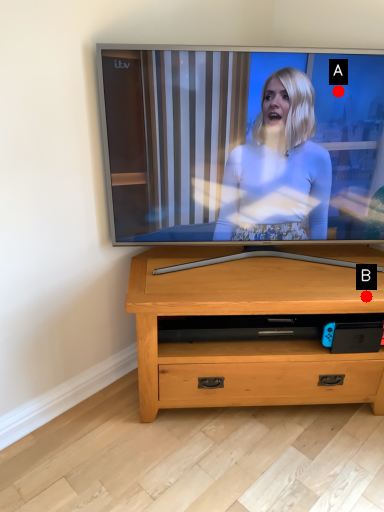
Question: Two points are circled on the image, labeled by A and B beside each circle. Which point is closer to the camera?

Choices:
 (A) A is closer
 (B) B is closer

Answer: (A)